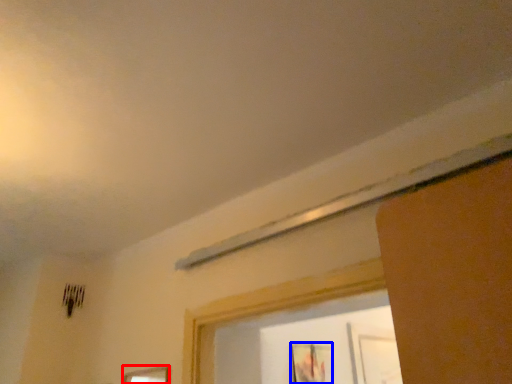
Question: Which of the following is the closest to the observer, picture frame (highlighted by a red box) or picture frame (highlighted by a blue box)?

Choices:
 (A) picture frame
 (B) picture frame

Answer: (A)